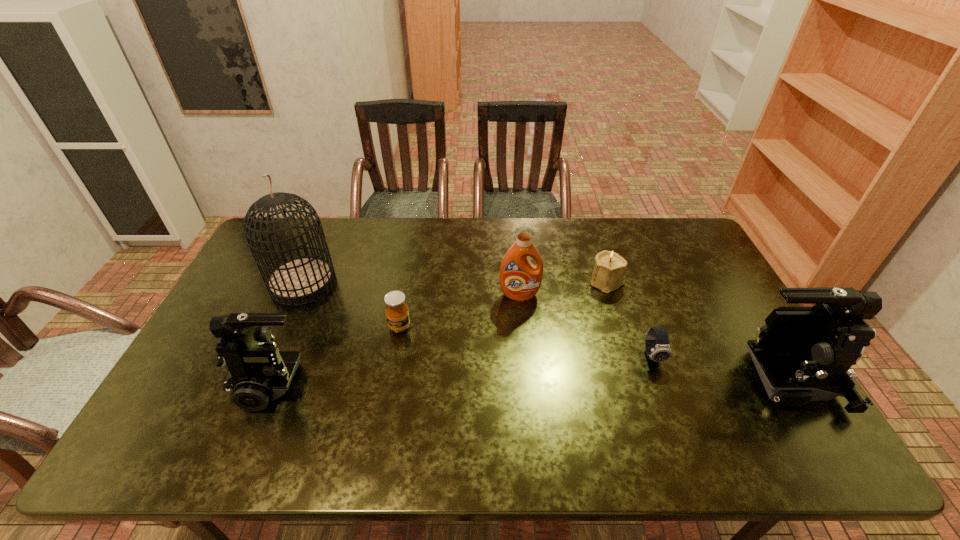
Please determine a free point for an extra camcorder to ensure balance. Please provide its 2D coordinates. Your answer should be formatted as a tuple, i.e. [(x, y)], where the tuple contains the x and y coordinates of a point satisfying the conditions above.

[(528, 381)]